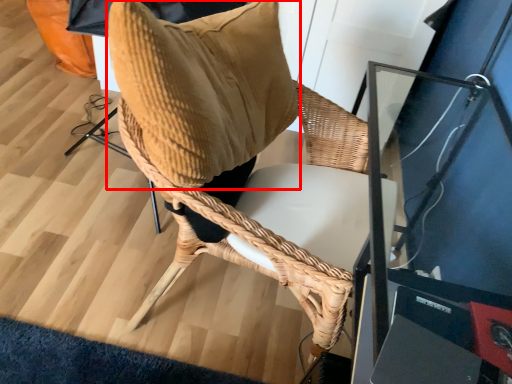
Question: From the image's perspective, considering the relative positions of bean bag chair (annotated by the red box) and chair in the image provided, where is bean bag chair (annotated by the red box) located with respect to the staircase?

Choices:
 (A) below
 (B) above

Answer: (B)